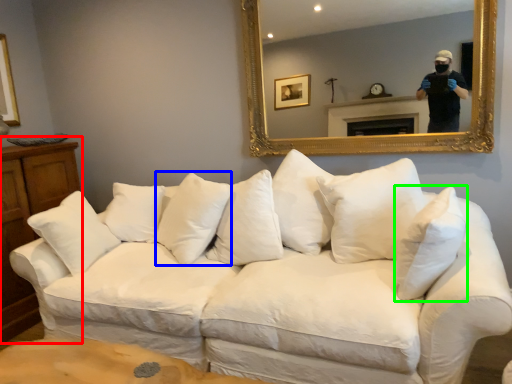
Question: Which is nearer to the dresser (highlighted by a red box)? pillow (highlighted by a blue box) or pillow (highlighted by a green box).

Choices:
 (A) pillow
 (B) pillow

Answer: (A)